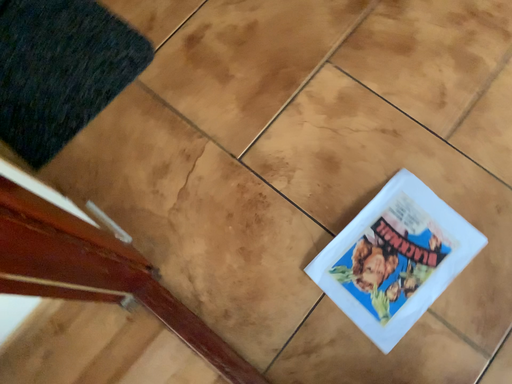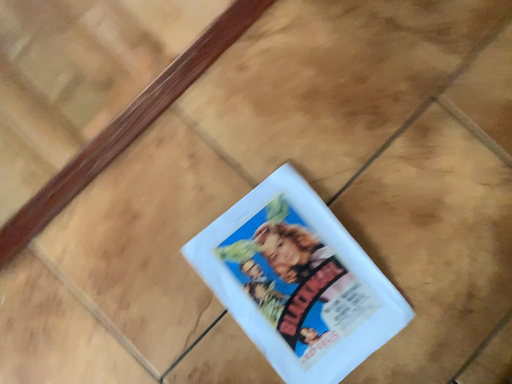
Question: Which way did the camera rotate in the video?

Choices:
 (A) rotated downward
 (B) rotated upward

Answer: (B)